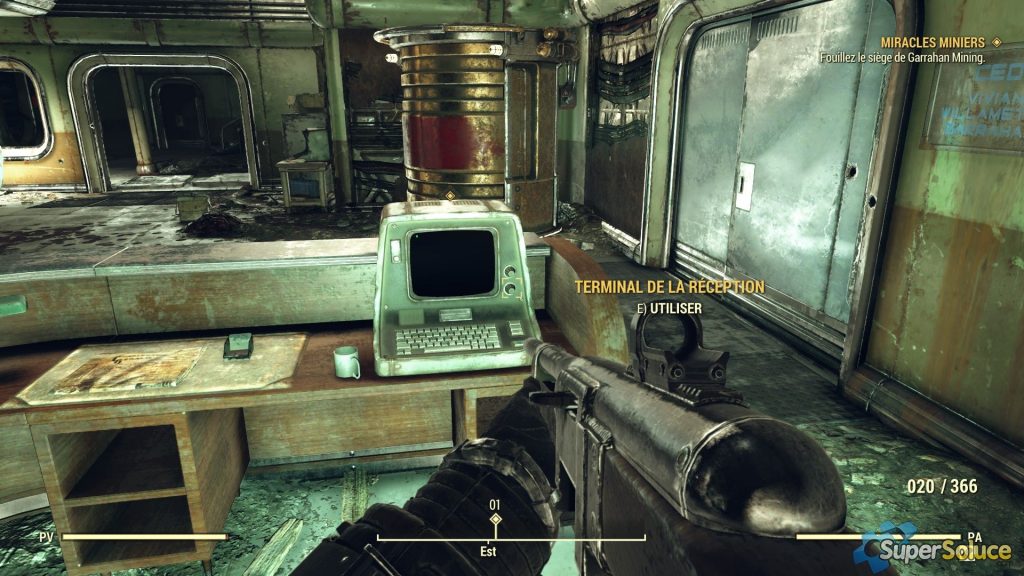
Identify the location of green wall. (920, 318).